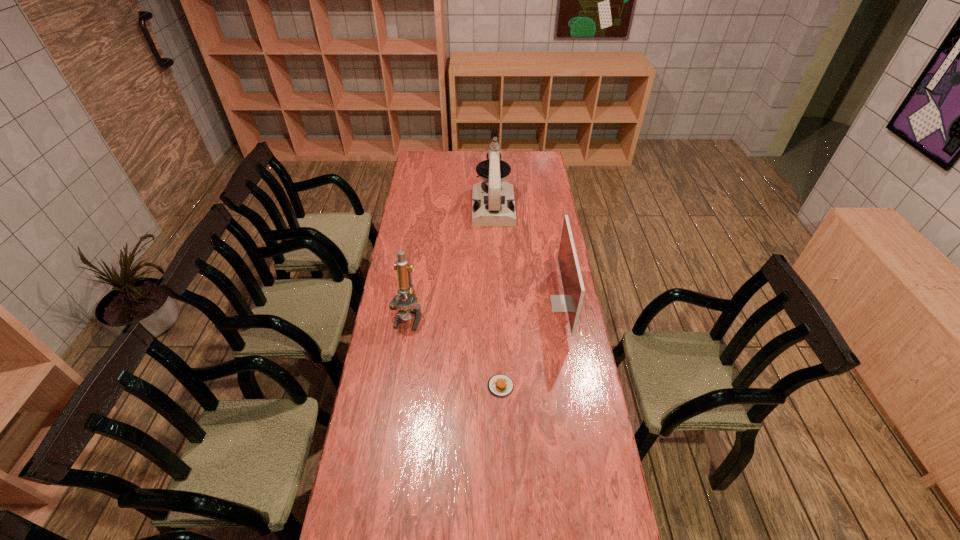
Where is `free location that satisfies the following two spatial constraints: 1. on the front-facing side of the rightmost object; 2. on the front side of the food`? free location that satisfies the following two spatial constraints: 1. on the front-facing side of the rightmost object; 2. on the front side of the food is located at coordinates (578, 386).

Where is `free space that satisfies the following two spatial constraints: 1. at the eyepiece of the taller microscope; 2. on the left side of the nearest object`? free space that satisfies the following two spatial constraints: 1. at the eyepiece of the taller microscope; 2. on the left side of the nearest object is located at coordinates tap(500, 386).

The image size is (960, 540). Find the location of `vacant space that satisfies the following two spatial constraints: 1. at the eyepiece of the nearest object; 2. on the right side of the farthest object`. vacant space that satisfies the following two spatial constraints: 1. at the eyepiece of the nearest object; 2. on the right side of the farthest object is located at coordinates (500, 386).

Locate an element on the screen. The width and height of the screenshot is (960, 540). free space in the image that satisfies the following two spatial constraints: 1. at the eyepiece of the farthest object; 2. on the right side of the nearest object is located at coordinates (500, 386).

The height and width of the screenshot is (540, 960). I want to click on free spot that satisfies the following two spatial constraints: 1. on the front side of the leftmost object; 2. on the right side of the nearest object, so [396, 386].